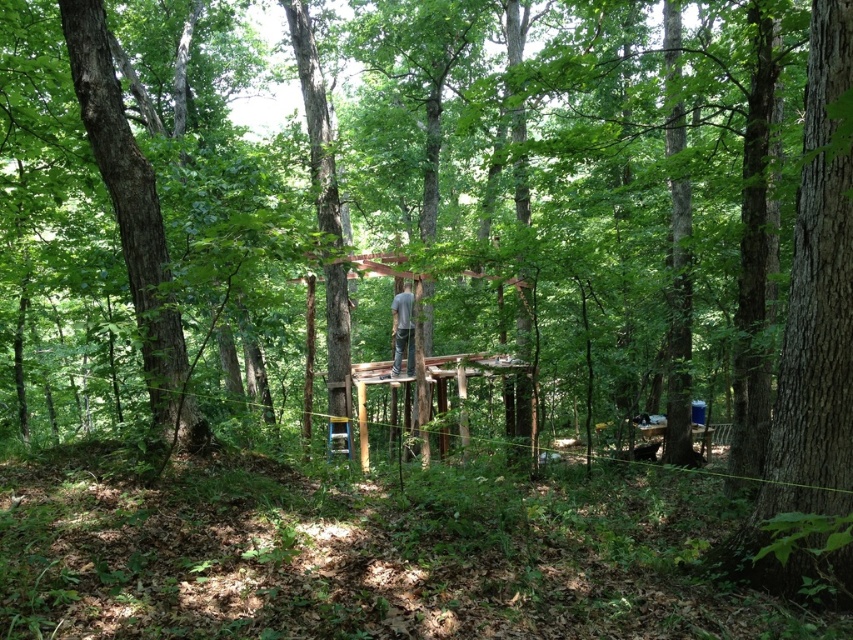
Question: Which point is farther to the camera?

Choices:
 (A) smooth brown tree trunk at left
 (B) green plastic ladder at center

Answer: (B)

Question: Which point is closer to the camera?

Choices:
 (A) (102, 100)
 (B) (344, 426)
 (C) (397, 332)

Answer: (A)

Question: Can you confirm if smooth brown tree trunk at left is positioned below gray fabric shirt at center?

Choices:
 (A) no
 (B) yes

Answer: (A)

Question: Among these points, which one is nearest to the camera?

Choices:
 (A) (338, 432)
 (B) (148, 385)

Answer: (B)

Question: Can you confirm if smooth brown tree trunk at left is positioned to the right of green plastic ladder at center?

Choices:
 (A) yes
 (B) no

Answer: (B)

Question: Does smooth brown tree trunk at left appear on the right side of gray fabric shirt at center?

Choices:
 (A) yes
 (B) no

Answer: (B)